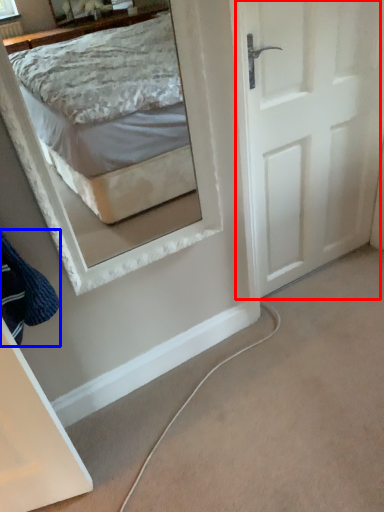
Question: Which point is closer to the camera, door (highlighted by a red box) or clothe (highlighted by a blue box)?

Choices:
 (A) door
 (B) clothe

Answer: (B)